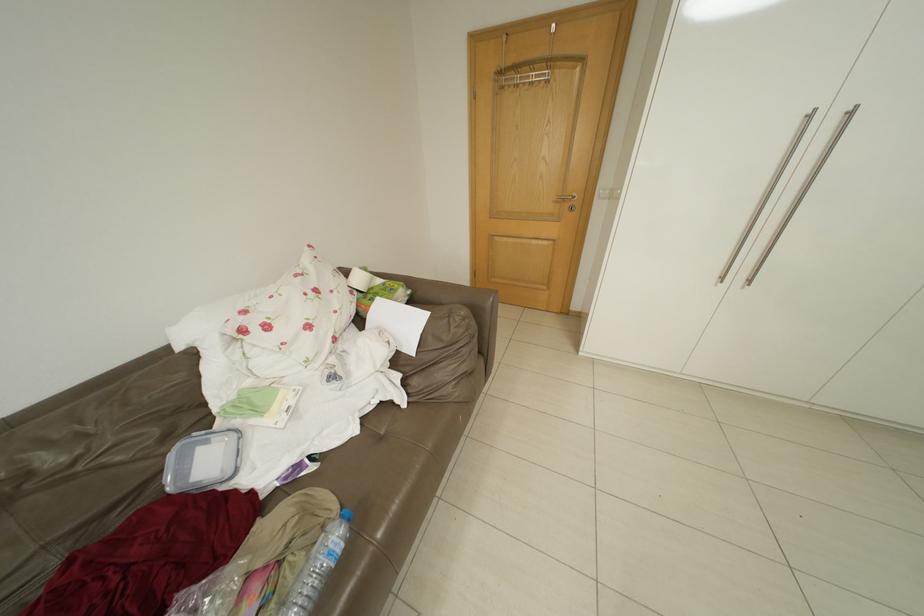
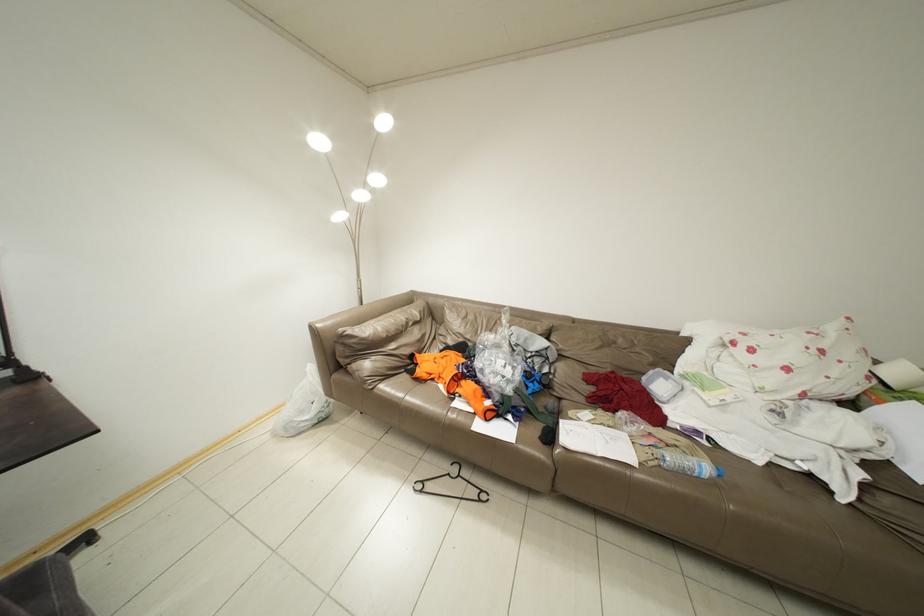
First-person continuous shooting, in which direction is the camera rotating?

The rotation direction of the camera is left-down.